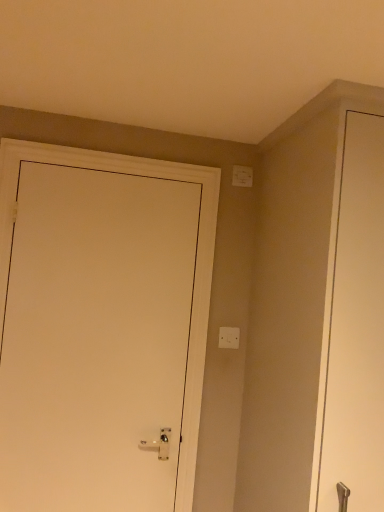
Question: Considering the relative sizes of white matte door at left and white plastic light switch at upper right, positioned as the second light switch in bottom-to-top order, in the image provided, is white matte door at left smaller than white plastic light switch at upper right, positioned as the second light switch in bottom-to-top order,?

Choices:
 (A) no
 (B) yes

Answer: (A)

Question: Considering the relative sizes of white matte door at left and white plastic light switch at upper right, arranged as the first light switch when viewed from the top, in the image provided, is white matte door at left wider than white plastic light switch at upper right, arranged as the first light switch when viewed from the top,?

Choices:
 (A) no
 (B) yes

Answer: (B)

Question: From the image's perspective, does white matte door at left appear lower than white plastic light switch at upper right, arranged as the first light switch when viewed from the top?

Choices:
 (A) no
 (B) yes

Answer: (B)

Question: Is white matte door at left to the left of white plastic light switch at upper right, positioned as the second light switch in bottom-to-top order, from the viewer's perspective?

Choices:
 (A) no
 (B) yes

Answer: (B)

Question: From a real-world perspective, is white matte door at left below white plastic light switch at upper right, arranged as the first light switch when viewed from the top?

Choices:
 (A) yes
 (B) no

Answer: (A)

Question: From the image's perspective, relative to white plastic light switch at upper right, positioned as the second light switch in bottom-to-top order, is white matte door at left above or below?

Choices:
 (A) below
 (B) above

Answer: (A)

Question: Is white matte door at left situated inside white plastic light switch at upper right, positioned as the second light switch in bottom-to-top order, or outside?

Choices:
 (A) outside
 (B) inside

Answer: (A)

Question: Considering the positions of white matte door at left and white plastic light switch at upper right, positioned as the second light switch in bottom-to-top order, in the image, is white matte door at left wider or thinner than white plastic light switch at upper right, positioned as the second light switch in bottom-to-top order,?

Choices:
 (A) wide
 (B) thin

Answer: (A)

Question: Is white matte door at left in front of or behind white plastic light switch at upper right, positioned as the second light switch in bottom-to-top order, in the image?

Choices:
 (A) front
 (B) behind

Answer: (A)

Question: From the image's perspective, is white plastic light switch at center, marked as the first light switch in a bottom-to-top arrangement, positioned above or below white plastic light switch at upper right, arranged as the first light switch when viewed from the top?

Choices:
 (A) below
 (B) above

Answer: (A)

Question: Considering the positions of white plastic light switch at center, positioned as the second light switch in top-to-bottom order, and white plastic light switch at upper right, arranged as the first light switch when viewed from the top, in the image, is white plastic light switch at center, positioned as the second light switch in top-to-bottom order, taller or shorter than white plastic light switch at upper right, arranged as the first light switch when viewed from the top,?

Choices:
 (A) tall
 (B) short

Answer: (B)

Question: Does point (223, 345) appear closer or farther from the camera than point (248, 178)?

Choices:
 (A) farther
 (B) closer

Answer: (B)

Question: Is white plastic light switch at center, positioned as the second light switch in top-to-bottom order, to the left or to the right of white plastic light switch at upper right, positioned as the second light switch in bottom-to-top order, in the image?

Choices:
 (A) left
 (B) right

Answer: (A)

Question: Looking at the image, does white plastic light switch at upper right, positioned as the second light switch in bottom-to-top order, seem bigger or smaller compared to white matte door at left?

Choices:
 (A) small
 (B) big

Answer: (A)

Question: From the image's perspective, relative to white matte door at left, is white plastic light switch at upper right, arranged as the first light switch when viewed from the top, above or below?

Choices:
 (A) above
 (B) below

Answer: (A)